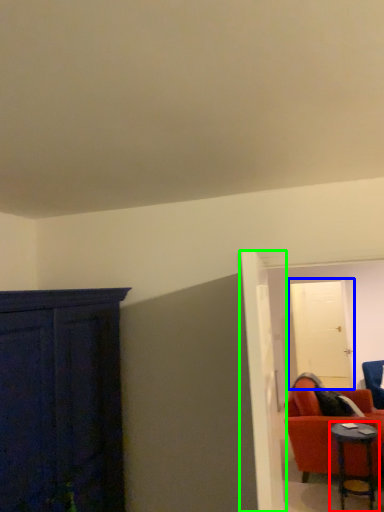
Question: Which object is positioned farthest from table (highlighted by a red box)? Select from door (highlighted by a blue box) and door (highlighted by a green box).

Choices:
 (A) door
 (B) door

Answer: (B)